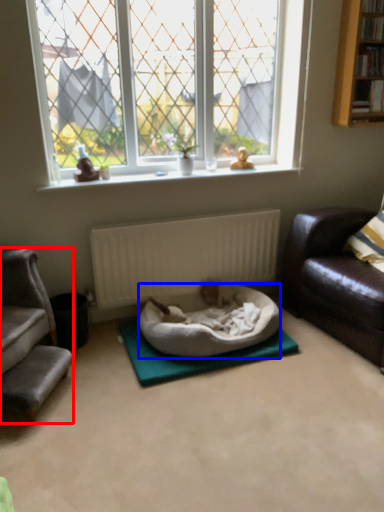
Question: Which object appears farthest to the camera in this image, studio couch (highlighted by a red box) or dog bed (highlighted by a blue box)?

Choices:
 (A) studio couch
 (B) dog bed

Answer: (B)